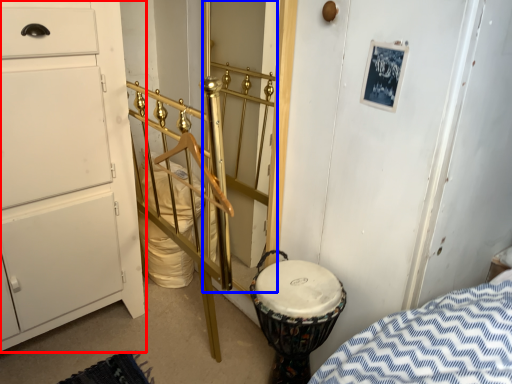
Question: Which point is further to the camera, chest of drawers (highlighted by a red box) or door (highlighted by a blue box)?

Choices:
 (A) chest of drawers
 (B) door

Answer: (B)